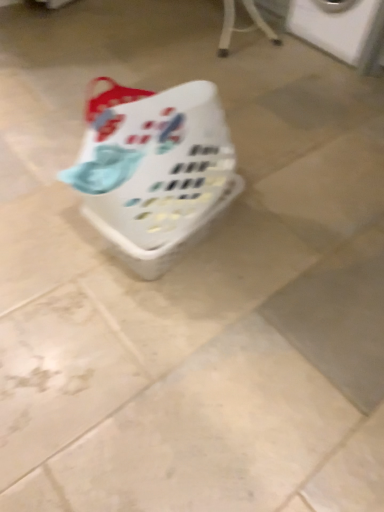
Image resolution: width=384 pixels, height=512 pixels. In order to click on vacant area located to the right-hand side of white plastic basket at center in this screenshot , I will do `click(276, 248)`.